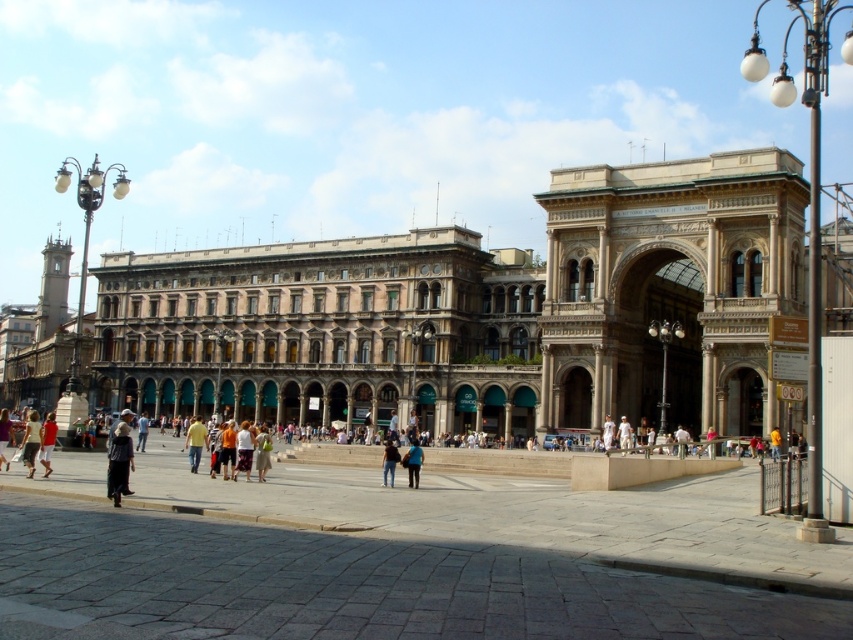
Which is more to the left, yellow cotton shirt at center or blue fabric jacket at center?

yellow cotton shirt at center is more to the left.

Which is behind, point (196, 467) or point (410, 448)?

The point (196, 467) is behind.

Locate an element on the screen. The image size is (853, 640). yellow cotton shirt at center is located at coordinates (195, 442).

Is point (254, 332) positioned in front of point (55, 433)?

No.

Between brown stone building at center and matte red shirt at lower left, which one has more height?

With more height is brown stone building at center.

Who is more forward, (x=485, y=272) or (x=42, y=460)?

Point (x=42, y=460) is in front.

You are a GUI agent. You are given a task and a screenshot of the screen. Output one action in this format:
    pyautogui.click(x=<x>, y=<y>)
    Task: Click on the brown stone building at center
    Image resolution: width=853 pixels, height=640 pixels.
    Given the screenshot: What is the action you would take?
    pyautogui.click(x=326, y=332)

Is point (32, 467) positioned before point (407, 467)?

Yes, it is in front of point (407, 467).

Is white cotton dress at center to the right of blue fabric jacket at center from the viewer's perspective?

In fact, white cotton dress at center is to the left of blue fabric jacket at center.

Locate an element on the screen. This screenshot has width=853, height=640. white cotton dress at center is located at coordinates (32, 442).